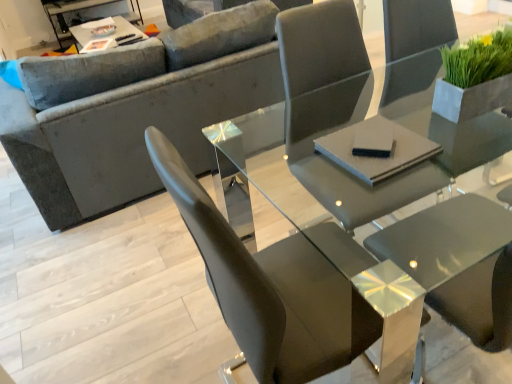
Question: From a real-world perspective, is glossy glass table at center, the 2th table viewed from the back, physically located above or below metallic silver tray at upper left, the 1th table positioned from the top?

Choices:
 (A) below
 (B) above

Answer: (B)

Question: Is glossy glass table at center, positioned as the first table in bottom-to-top order, to the left or to the right of metallic silver tray at upper left, placed as the 1th table when sorted from left to right, in the image?

Choices:
 (A) left
 (B) right

Answer: (B)

Question: Based on their relative distances, which object is farther from the metallic silver tray at upper left, placed as the second table when sorted from front to back?

Choices:
 (A) gray matte pad at center, the first pad when ordered from right to left
 (B) glossy glass table at center, arranged as the second table when viewed from the top
 (C) matte gray chair at center
 (D) velvet gray couch at upper left
 (E) green matte plant at upper right

Answer: (E)

Question: Which of these objects is positioned farthest from the matte gray chair at center?

Choices:
 (A) green matte plant at upper right
 (B) gray matte pad at center, the first pad when ordered from right to left
 (C) glossy glass table at center, placed as the 2th table when sorted from left to right
 (D) metallic silver tray at upper left, which is the 2th table in right-to-left order
 (E) black matte pad at center, positioned as the 2th pad in right-to-left order

Answer: (D)